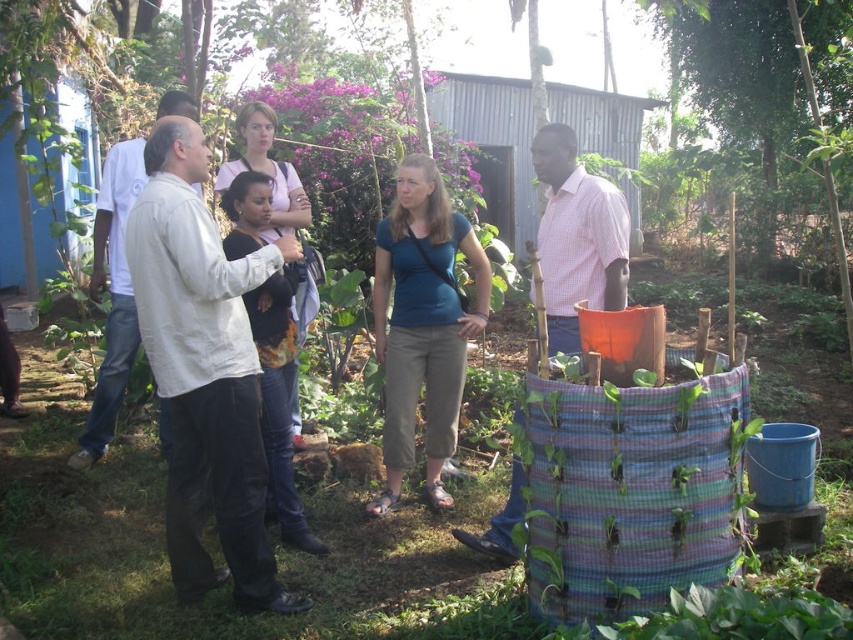
You are standing in the garden and want to find the person wearing the white cotton shirt at center. Based on their position, can you tell me what direction you should look in to see them?

The white cotton shirt at center is located at coordinates approximately 0.580 on the x axis and 0.239 on the y axis, so you should look towards the center of the garden area to find them.

From the picture: You are a photographer standing in the garden scene. You want to take a photo that includes both the blue cotton shirt at center and the green leafy tree at upper right. Which object should you focus on first to ensure both are in clear view?

You should focus on the blue cotton shirt at center first because it is closer to the viewer than the green leafy tree at upper right, ensuring both are in clear focus when using depth of field.

Based on the photo, you are part of a gardening group in the image and want to introduce yourself to the person wearing the blue cotton shirt at center. Which direction should you walk to reach them from the white cotton shirt at center?

The white cotton shirt at center is to the left of the blue cotton shirt at center. So, you should walk to the right to reach the blue cotton shirt at center from the white cotton shirt at center.